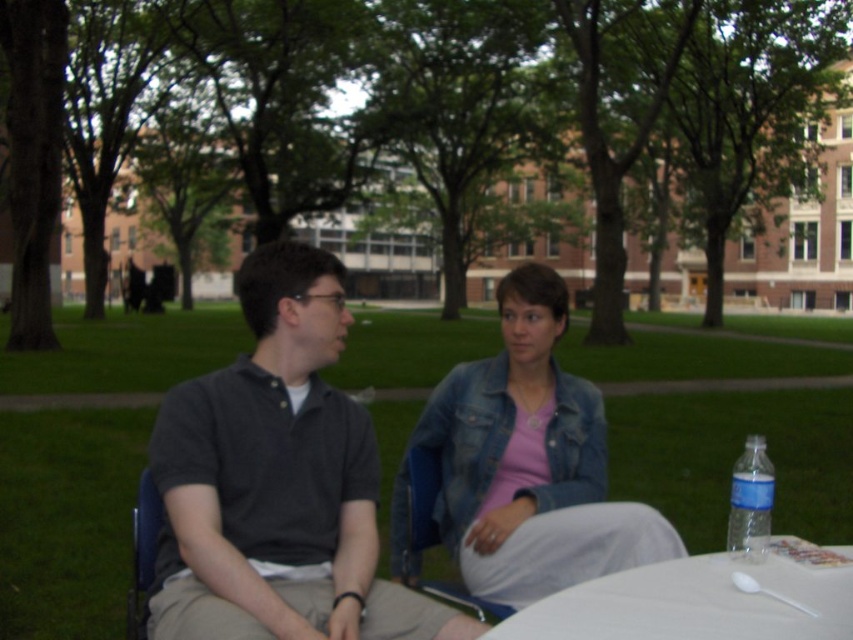
Between point (286, 627) and point (485, 579), which one is positioned behind?

The point (485, 579) is more distant.

The width and height of the screenshot is (853, 640). Find the location of `dark gray cotton polo shirt at center`. dark gray cotton polo shirt at center is located at coordinates [x=277, y=483].

Does point (454, 449) come in front of point (413, 525)?

No, (454, 449) is further to viewer.

Who is more forward, (x=521, y=488) or (x=479, y=602)?

Positioned in front is point (x=479, y=602).

Does point (398, 541) come behind point (502, 618)?

That is True.

The height and width of the screenshot is (640, 853). I want to click on pink denim jacket at center, so click(531, 461).

Does dark gray cotton polo shirt at center have a smaller size compared to white plastic spoon at lower right?

Yes.

Between dark gray cotton polo shirt at center and white plastic spoon at lower right, which one is positioned higher?

white plastic spoon at lower right is higher up.

Locate an element on the screen. dark gray cotton polo shirt at center is located at coordinates (277, 483).

You are a GUI agent. You are given a task and a screenshot of the screen. Output one action in this format:
    pyautogui.click(x=<x>, y=<y>)
    Task: Click on the dark gray cotton polo shirt at center
    This screenshot has width=853, height=640.
    Given the screenshot: What is the action you would take?
    pyautogui.click(x=277, y=483)